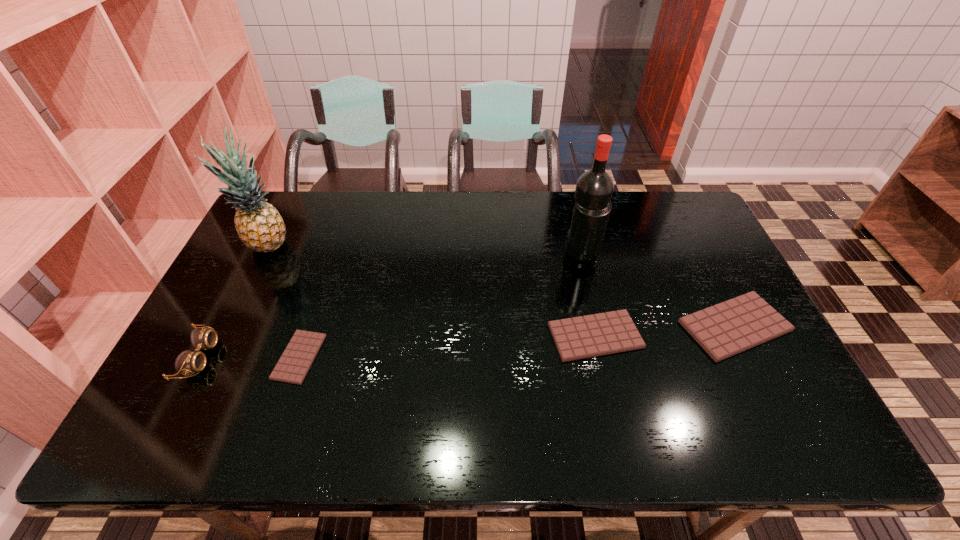
You are a GUI agent. You are given a task and a screenshot of the screen. Output one action in this format:
    pyautogui.click(x=<x>, y=<y>)
    Task: Click on the leftmost chocolate bar
    The image size is (960, 540).
    Given the screenshot: What is the action you would take?
    pyautogui.click(x=292, y=367)

Where is `the shortest object`? This screenshot has width=960, height=540. the shortest object is located at coordinates [x=292, y=367].

Find the location of `the second chocolate bar from left to right`. the second chocolate bar from left to right is located at coordinates (587, 336).

Find the location of a particular element. This screenshot has width=960, height=540. the second shortest object is located at coordinates coord(587,336).

Locate an element on the screen. The height and width of the screenshot is (540, 960). the rightmost chocolate bar is located at coordinates (728, 328).

This screenshot has width=960, height=540. I want to click on wine bottle, so click(x=594, y=188).

At what (x,y) coordinates should I click in order to perform the action: click on pineapple. Please return your answer as a coordinate pair (x, y). The image size is (960, 540). Looking at the image, I should click on (259, 225).

Find the location of `goggles`. goggles is located at coordinates (188, 362).

The width and height of the screenshot is (960, 540). Identify the location of vacant area situated 0.100m on the right of the fourth object from right to left. (359, 356).

I want to click on vacant space located on the left of the second shortest chocolate bar, so click(x=406, y=336).